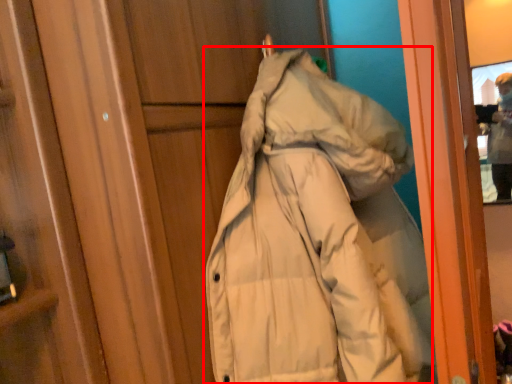
Question: Considering the relative positions of coat (annotated by the red box) and individual in the image provided, where is coat (annotated by the red box) located with respect to the staircase?

Choices:
 (A) right
 (B) left

Answer: (B)